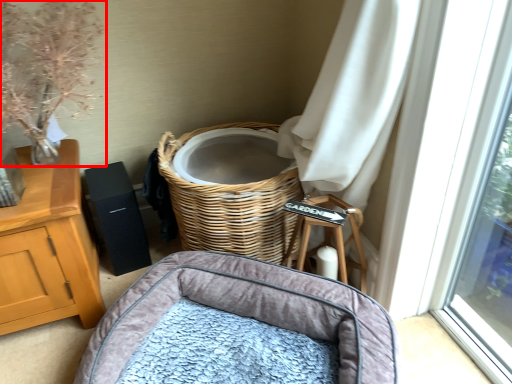
Question: Considering the relative positions of floral arrangement (annotated by the red box) and infant bed in the image provided, where is floral arrangement (annotated by the red box) located with respect to the staircase?

Choices:
 (A) left
 (B) right

Answer: (A)